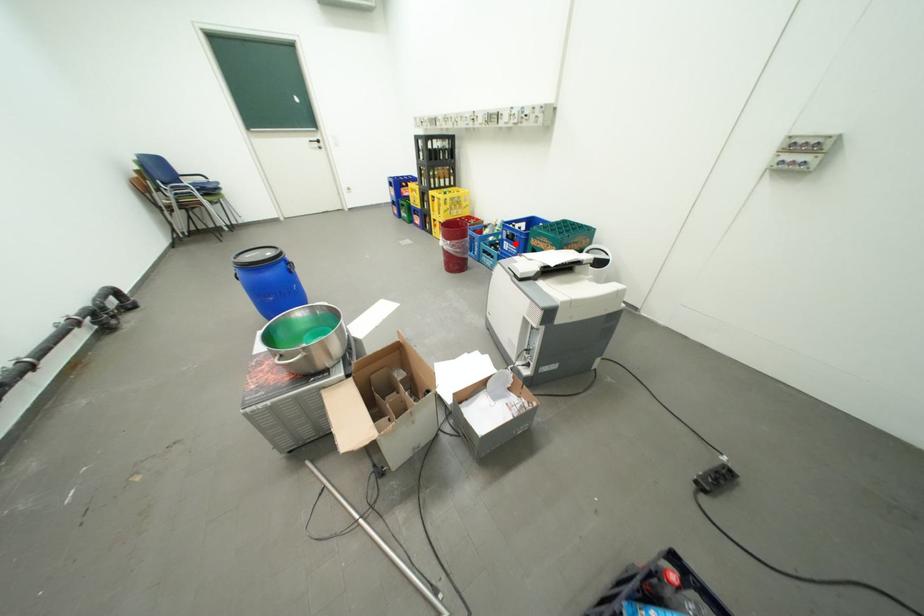
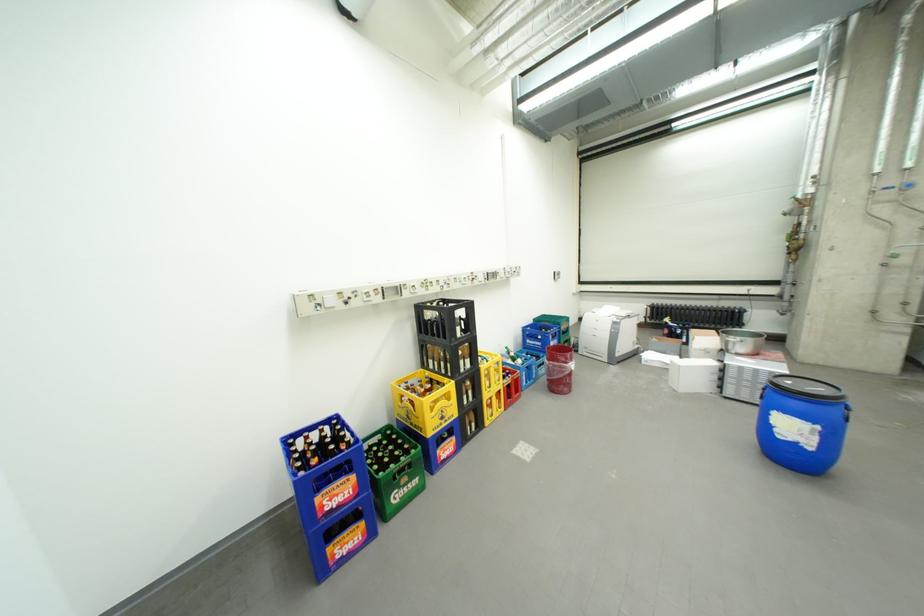
Question: I am providing you with two images of the same scene from different viewpoints. Given a red point in image1, look at the same physical point in image2. Is it:

Choices:
 (A) Closer to the viewpoint
 (B) Farther from the viewpoint

Answer: (A)